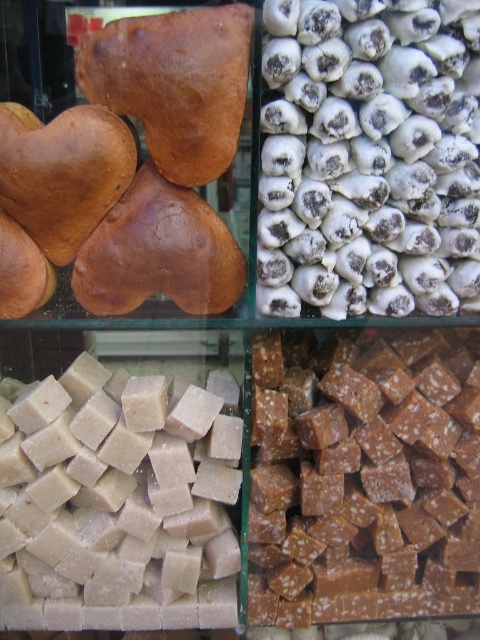
Between white sugared candy at upper right and caramelized sugar cubes at center, which one appears on the right side from the viewer's perspective?

caramelized sugar cubes at center is more to the right.

Consider the image. Is white sugared candy at upper right wider than caramelized sugar cubes at center?

No.

Is point (464, 93) positioned before point (285, 392)?

That is True.

I want to click on white sugared candy at upper right, so point(370,157).

Does caramelized sugar cubes at center have a lesser width compared to matte brown heart-shaped bread at upper left?

No, caramelized sugar cubes at center is not thinner than matte brown heart-shaped bread at upper left.

In the scene shown: Who is taller, caramelized sugar cubes at center or matte brown heart-shaped bread at upper left?

caramelized sugar cubes at center is taller.

Between point (286, 593) and point (232, 67), which one is positioned in front?

Point (232, 67) is more forward.

Where is `caramelized sugar cubes at center`? caramelized sugar cubes at center is located at coordinates (364, 476).

Can you confirm if white sugary cubes at bottom left is bigger than matte brown heart-shaped bread at upper left?

Indeed, white sugary cubes at bottom left has a larger size compared to matte brown heart-shaped bread at upper left.

Locate an element on the screen. white sugary cubes at bottom left is located at coordinates (117, 502).

Identify the location of white sugary cubes at bottom left. The height and width of the screenshot is (640, 480). (117, 502).